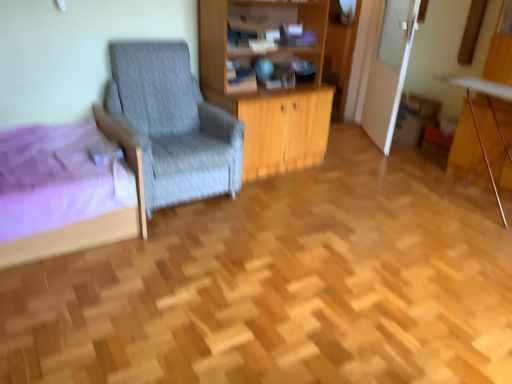
You are a GUI agent. You are given a task and a screenshot of the screen. Output one action in this format:
    pyautogui.click(x=<x>, y=<y>)
    Task: Click on the vacant area that lies between gray fabric chair at left and purple fabric bed at lower left
    The height and width of the screenshot is (384, 512).
    Given the screenshot: What is the action you would take?
    pyautogui.click(x=190, y=215)